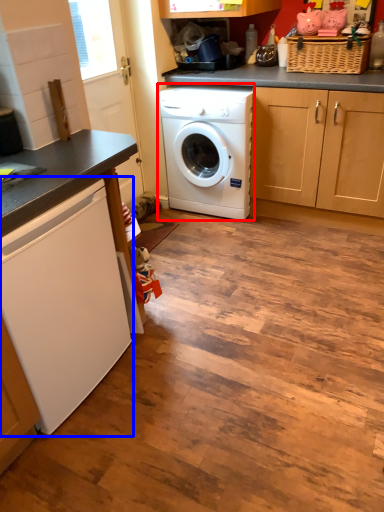
Question: Among these objects, which one is nearest to the camera, washing machine (highlighted by a red box) or washing machine (highlighted by a blue box)?

Choices:
 (A) washing machine
 (B) washing machine

Answer: (B)